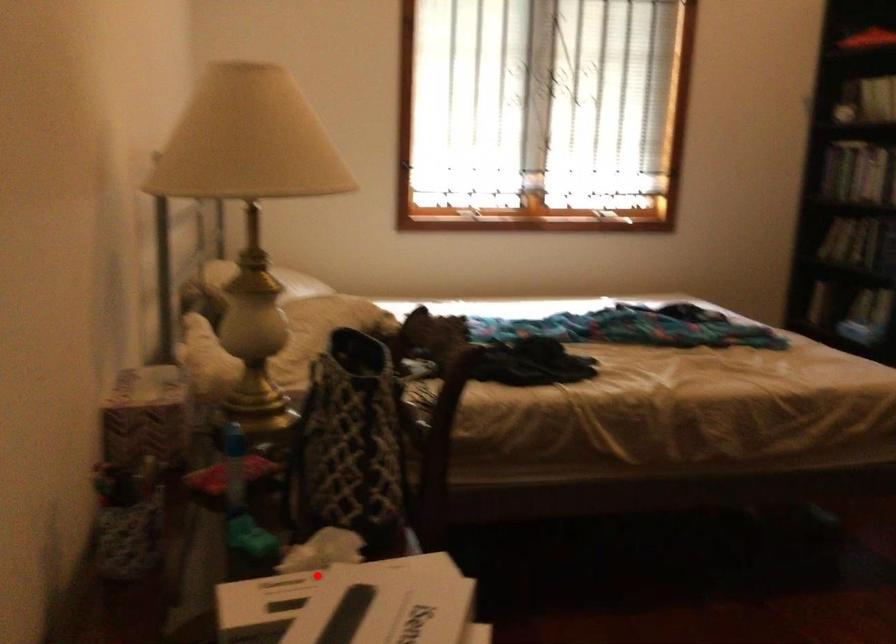
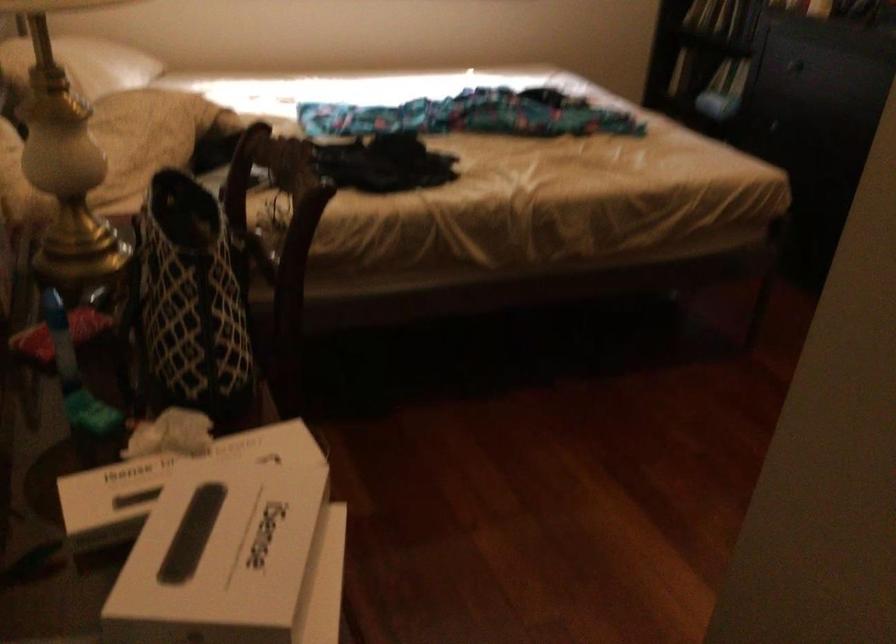
In the second image, find the point that corresponds to the highlighted location in the first image.

(168, 477)